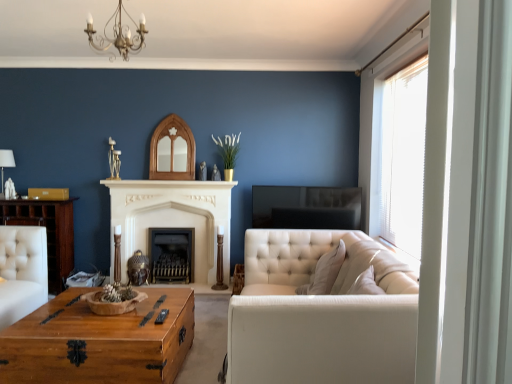
Question: From a real-world perspective, is wooden coffee table at center beneath white stone fireplace at center, the 1th fireplace from the front?

Choices:
 (A) yes
 (B) no

Answer: (A)

Question: Can you confirm if wooden coffee table at center is taller than white stone fireplace at center, the 1th fireplace from the front?

Choices:
 (A) no
 (B) yes

Answer: (A)

Question: Is wooden coffee table at center smaller than white stone fireplace at center, the 1th fireplace from the front?

Choices:
 (A) yes
 (B) no

Answer: (B)

Question: Is wooden coffee table at center not within white stone fireplace at center, the 1th fireplace from the front?

Choices:
 (A) no
 (B) yes

Answer: (B)

Question: Considering the relative sizes of wooden coffee table at center and white stone fireplace at center, the 1th fireplace from the front, in the image provided, is wooden coffee table at center bigger than white stone fireplace at center, the 1th fireplace from the front,?

Choices:
 (A) yes
 (B) no

Answer: (A)

Question: From a real-world perspective, is white marble fireplace at center positioned above or below gold metallic chandelier at upper center?

Choices:
 (A) above
 (B) below

Answer: (B)

Question: Is white marble fireplace at center to the left or to the right of gold metallic chandelier at upper center in the image?

Choices:
 (A) left
 (B) right

Answer: (A)

Question: From the image's perspective, is white marble fireplace at center positioned above or below gold metallic chandelier at upper center?

Choices:
 (A) below
 (B) above

Answer: (A)

Question: In the image, is white marble fireplace at center positioned in front of or behind gold metallic chandelier at upper center?

Choices:
 (A) behind
 (B) front

Answer: (A)

Question: Is white marble fireplace at center in front of or behind white stone fireplace at center, the 1th fireplace from the front, in the image?

Choices:
 (A) behind
 (B) front

Answer: (B)

Question: In the image, is white marble fireplace at center on the left side or the right side of white stone fireplace at center, which ranks as the second fireplace in back-to-front order?

Choices:
 (A) right
 (B) left

Answer: (A)

Question: From a real-world perspective, is white marble fireplace at center physically located above or below white stone fireplace at center, the 1th fireplace from the front?

Choices:
 (A) below
 (B) above

Answer: (B)

Question: Based on their sizes in the image, would you say white marble fireplace at center is bigger or smaller than white stone fireplace at center, the 1th fireplace from the front?

Choices:
 (A) big
 (B) small

Answer: (B)

Question: From the image's perspective, relative to wooden coffee table at center, is white stone fireplace at center, which ranks as the second fireplace in back-to-front order, above or below?

Choices:
 (A) below
 (B) above

Answer: (B)

Question: Which is correct: white stone fireplace at center, which ranks as the second fireplace in back-to-front order, is inside wooden coffee table at center, or outside of it?

Choices:
 (A) inside
 (B) outside

Answer: (B)